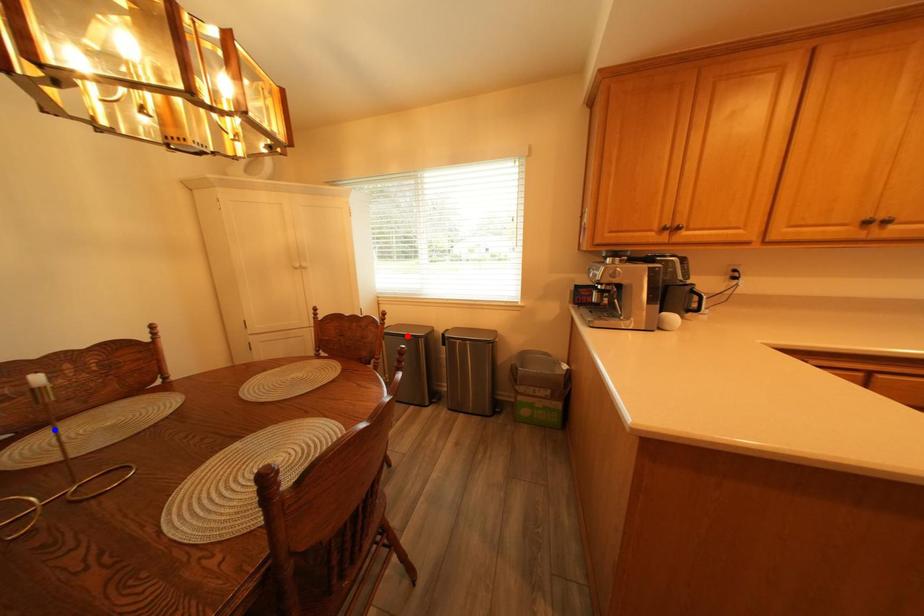
Question: Two points are marked on the image. Which point is closer to the camera?

Choices:
 (A) Blue point is closer.
 (B) Red point is closer.

Answer: (A)